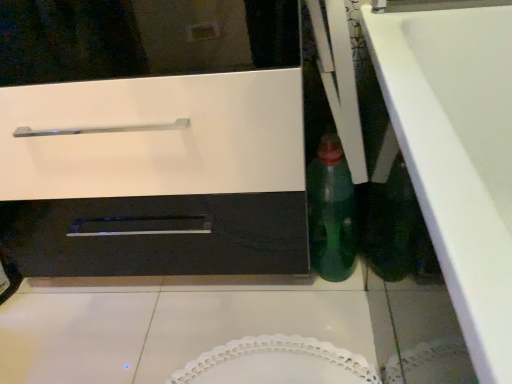
The width and height of the screenshot is (512, 384). Identify the location of vacant area in front of white glossy oven at center. 178,338.